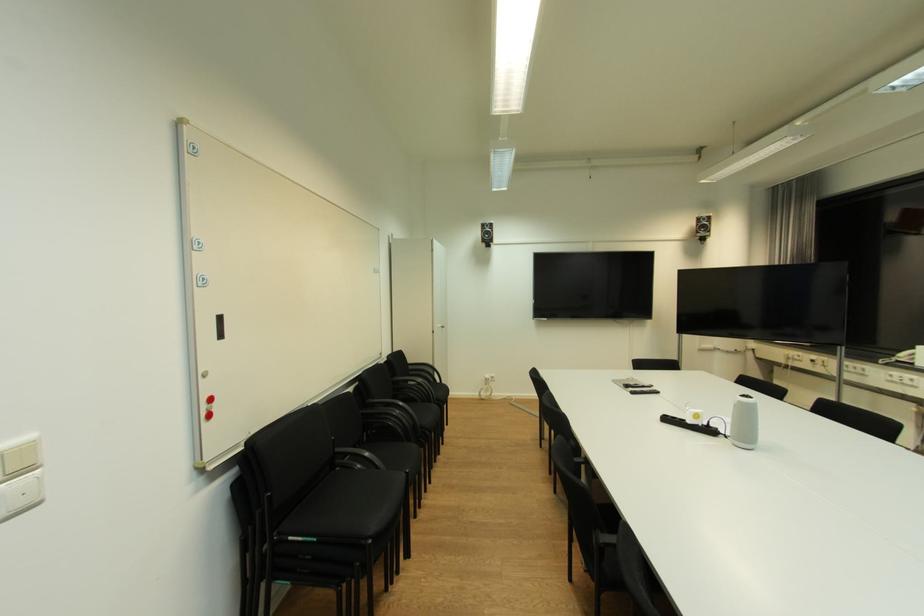
Where is `chair sitting surface`? The width and height of the screenshot is (924, 616). chair sitting surface is located at coordinates (350, 504).